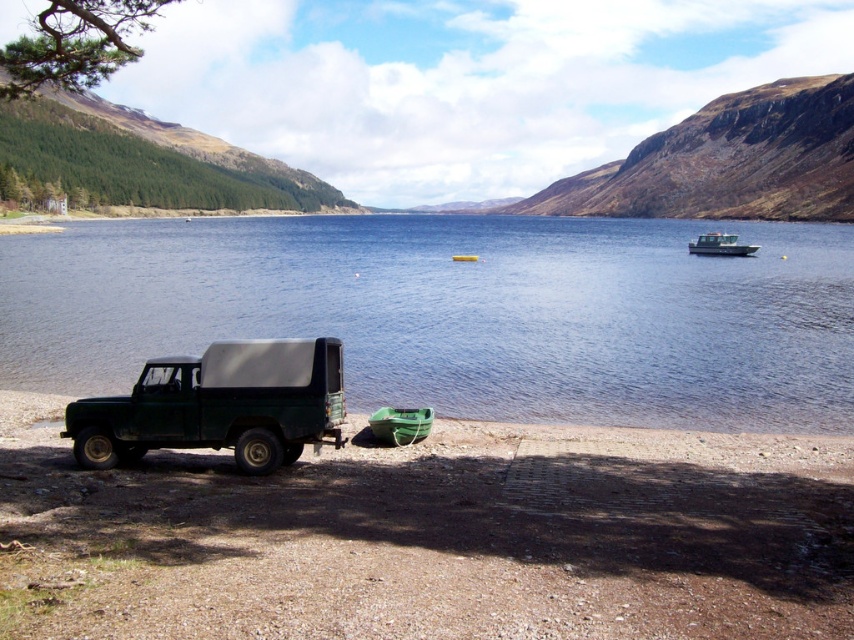
Which is below, white plastic boat at center or green rubber boat at center?

Positioned lower is green rubber boat at center.

Between white plastic boat at center and green rubber boat at center, which one has more height?

Standing taller between the two is white plastic boat at center.

Locate an element on the screen. The height and width of the screenshot is (640, 854). white plastic boat at center is located at coordinates (718, 244).

This screenshot has width=854, height=640. Find the location of `white plastic boat at center`. white plastic boat at center is located at coordinates (718, 244).

Can you confirm if green rubber boat at lower center is positioned below white plastic boat at center?

Yes, green rubber boat at lower center is below white plastic boat at center.

Between green rubber boat at lower center and white plastic boat at center, which one has less height?

Standing shorter between the two is green rubber boat at lower center.

The height and width of the screenshot is (640, 854). What do you see at coordinates (401, 424) in the screenshot?
I see `green rubber boat at lower center` at bounding box center [401, 424].

Image resolution: width=854 pixels, height=640 pixels. Identify the location of green rubber boat at lower center. (401, 424).

Image resolution: width=854 pixels, height=640 pixels. I want to click on blue water at center, so click(458, 312).

Does point (273, 237) come closer to viewer compared to point (337, 342)?

No, it is behind (337, 342).

The height and width of the screenshot is (640, 854). What do you see at coordinates (458, 312) in the screenshot? I see `blue water at center` at bounding box center [458, 312].

This screenshot has width=854, height=640. What are the coordinates of `blue water at center` in the screenshot? It's located at (458, 312).